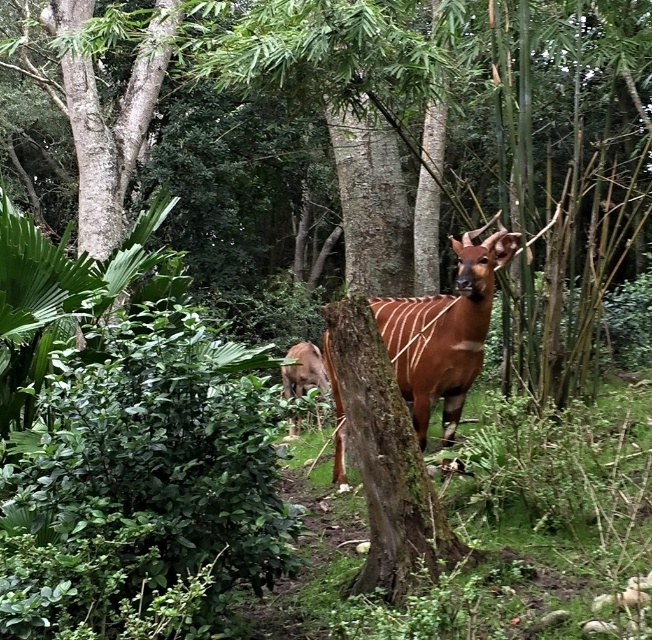
Between green mossy bark tree trunk at center and brown glossy deer at center, which one appears on the right side from the viewer's perspective?

From the viewer's perspective, brown glossy deer at center appears more on the right side.

Does green mossy bark tree trunk at center come in front of brown glossy deer at center?

Yes, it is.

Which is behind, point (398, 449) or point (454, 337)?

Point (454, 337)

The height and width of the screenshot is (640, 652). What are the coordinates of `green mossy bark tree trunk at center` in the screenshot? It's located at (389, 472).

Can you confirm if brown glossy deer at center is smaller than brown velvet antelope at center?

Incorrect, brown glossy deer at center is not smaller in size than brown velvet antelope at center.

Is brown glossy deer at center below brown velvet antelope at center?

No, brown glossy deer at center is not below brown velvet antelope at center.

Where is `brown glossy deer at center`? The image size is (652, 640). brown glossy deer at center is located at coordinates (445, 332).

Identify the location of brown glossy deer at center. (445, 332).

Based on the photo, who is lower down, green mossy bark tree trunk at center or brown velvet antelope at center?

brown velvet antelope at center

At what (x,y) coordinates should I click in order to perform the action: click on green mossy bark tree trunk at center. Please return your answer as a coordinate pair (x, y). This screenshot has height=640, width=652. Looking at the image, I should click on (389, 472).

The image size is (652, 640). Identify the location of green mossy bark tree trunk at center. (389, 472).